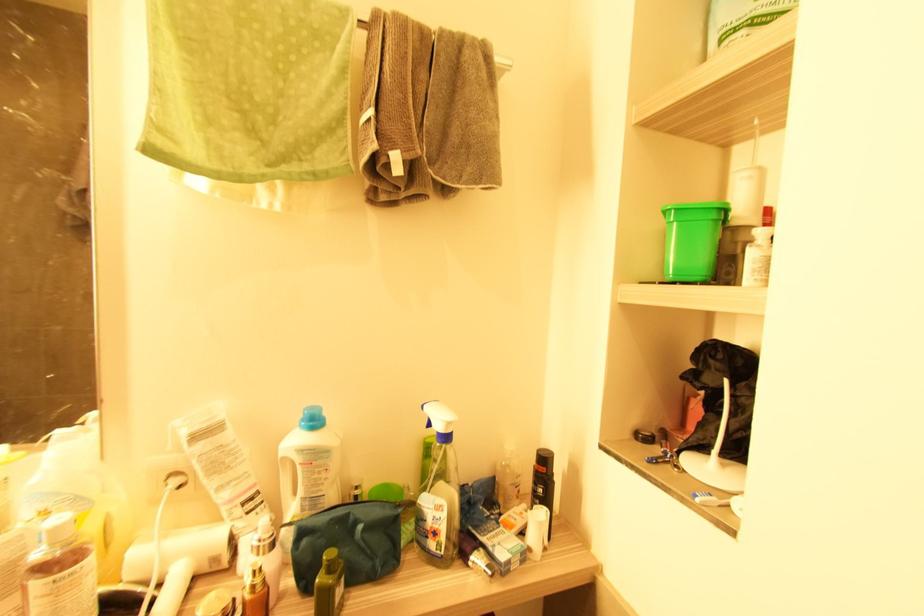
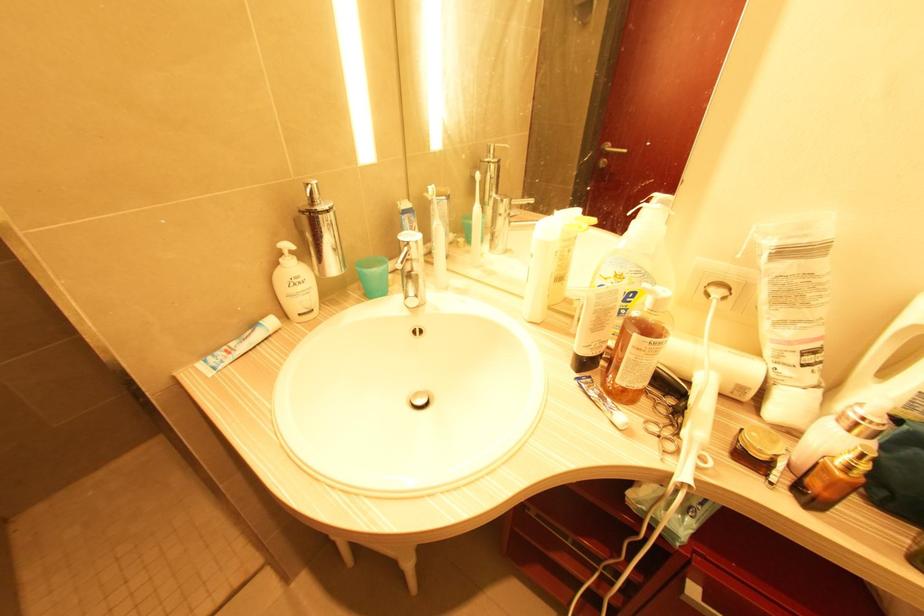
Locate, in the second image, the point that corresponds to pixel 216 561 in the first image.

(743, 390)